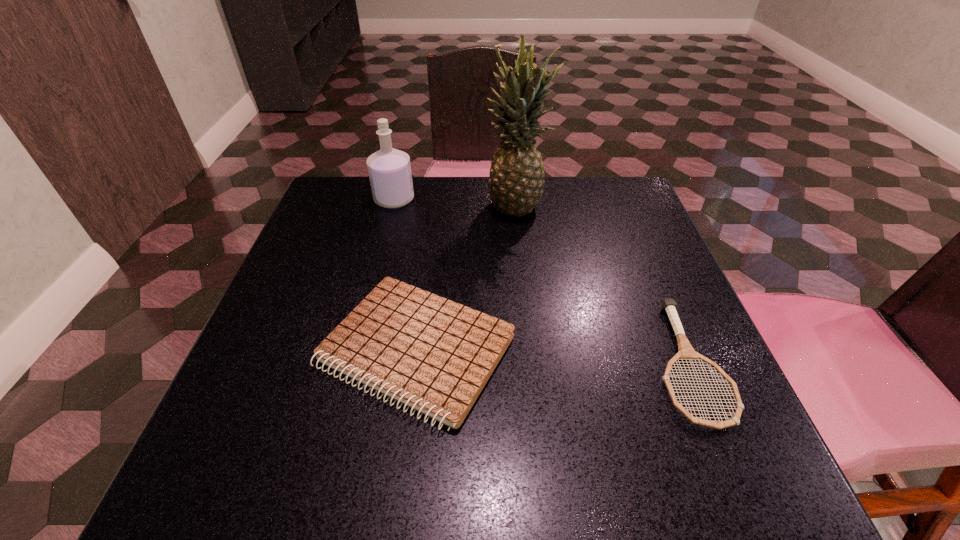
The width and height of the screenshot is (960, 540). I want to click on pineapple, so click(516, 180).

This screenshot has width=960, height=540. I want to click on perfume, so click(x=389, y=169).

Find the location of a particular element. notebook is located at coordinates (434, 355).

Find the location of `tennis racket`. tennis racket is located at coordinates (686, 352).

Locate an element on the screen. The width and height of the screenshot is (960, 540). free space located on the front of the tallest object is located at coordinates (527, 294).

Locate an element on the screen. This screenshot has height=540, width=960. vacant space located on the front of the third shortest object is located at coordinates (363, 320).

Identify the location of vacant area situated on the left of the notebook. (279, 349).

I want to click on vacant space situated 0.210m on the back of the rightmost object, so click(636, 240).

I want to click on pineapple positioned at the far edge, so click(x=516, y=180).

Find the location of a particular element. perfume situated at the far edge is located at coordinates (389, 169).